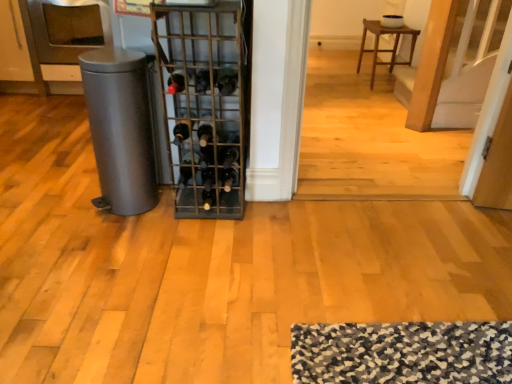
Question: Should I look upward or downward to see matte gray trash can at left?

Choices:
 (A) up
 (B) down

Answer: (A)

Question: Does black glass wine bottle at center, the 6th wine bottle from the right, have a greater height compared to matte gray trash can at left?

Choices:
 (A) no
 (B) yes

Answer: (A)

Question: Is black glass wine bottle at center, the 6th wine bottle from the right, outside matte gray trash can at left?

Choices:
 (A) yes
 (B) no

Answer: (A)

Question: Considering the relative sizes of black glass wine bottle at center, the 6th wine bottle from the right, and matte gray trash can at left in the image provided, is black glass wine bottle at center, the 6th wine bottle from the right, smaller than matte gray trash can at left?

Choices:
 (A) yes
 (B) no

Answer: (A)

Question: Considering the relative positions of black glass wine bottle at center, the first wine bottle from the left, and matte gray trash can at left in the image provided, is black glass wine bottle at center, the first wine bottle from the left, behind matte gray trash can at left?

Choices:
 (A) yes
 (B) no

Answer: (A)

Question: Is black glass wine bottle at center, the first wine bottle from the left, closer to the viewer compared to matte gray trash can at left?

Choices:
 (A) yes
 (B) no

Answer: (B)

Question: Could you tell me if black glass wine bottle at center, the 6th wine bottle from the right, is turned towards matte gray trash can at left?

Choices:
 (A) no
 (B) yes

Answer: (A)

Question: Considering the relative positions of black glass wine bottle at center, acting as the fourth wine bottle starting from the left, and shiny dark red wine bottle at center, arranged as the fifth wine bottle when viewed from the right, in the image provided, is black glass wine bottle at center, acting as the fourth wine bottle starting from the left, to the right of shiny dark red wine bottle at center, arranged as the fifth wine bottle when viewed from the right, from the viewer's perspective?

Choices:
 (A) no
 (B) yes

Answer: (B)

Question: From the image's perspective, is black glass wine bottle at center, which is the 3th wine bottle from right to left, below shiny dark red wine bottle at center, which is the 2th wine bottle in left-to-right order?

Choices:
 (A) no
 (B) yes

Answer: (A)

Question: From a real-world perspective, is black glass wine bottle at center, acting as the fourth wine bottle starting from the left, physically above shiny dark red wine bottle at center, arranged as the fifth wine bottle when viewed from the right?

Choices:
 (A) no
 (B) yes

Answer: (B)

Question: Is black glass wine bottle at center, which is the 3th wine bottle from right to left, looking in the opposite direction of shiny dark red wine bottle at center, which is the 2th wine bottle in left-to-right order?

Choices:
 (A) yes
 (B) no

Answer: (B)

Question: Considering the relative sizes of black glass wine bottle at center, acting as the fourth wine bottle starting from the left, and shiny dark red wine bottle at center, which is the 2th wine bottle in left-to-right order, in the image provided, is black glass wine bottle at center, acting as the fourth wine bottle starting from the left, smaller than shiny dark red wine bottle at center, which is the 2th wine bottle in left-to-right order,?

Choices:
 (A) yes
 (B) no

Answer: (B)

Question: Is shiny dark red wine bottle at center, arranged as the fifth wine bottle when viewed from the right, completely or partially inside black glass wine bottle at center, acting as the fourth wine bottle starting from the left?

Choices:
 (A) yes
 (B) no

Answer: (B)

Question: Can you confirm if matte gray trash can at left is taller than black glass wine bottle at center, which is counted as the 2th wine bottle, starting from the right?

Choices:
 (A) no
 (B) yes

Answer: (B)